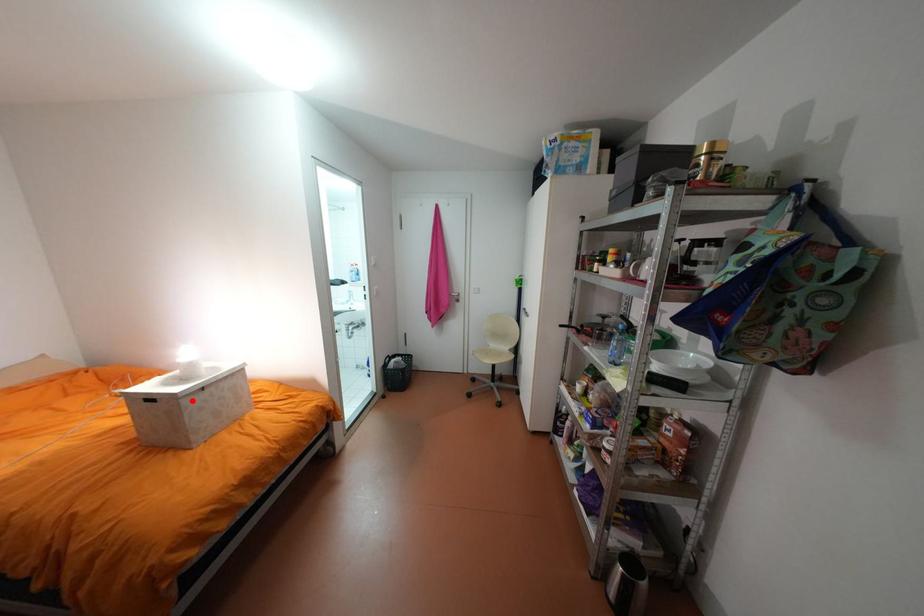
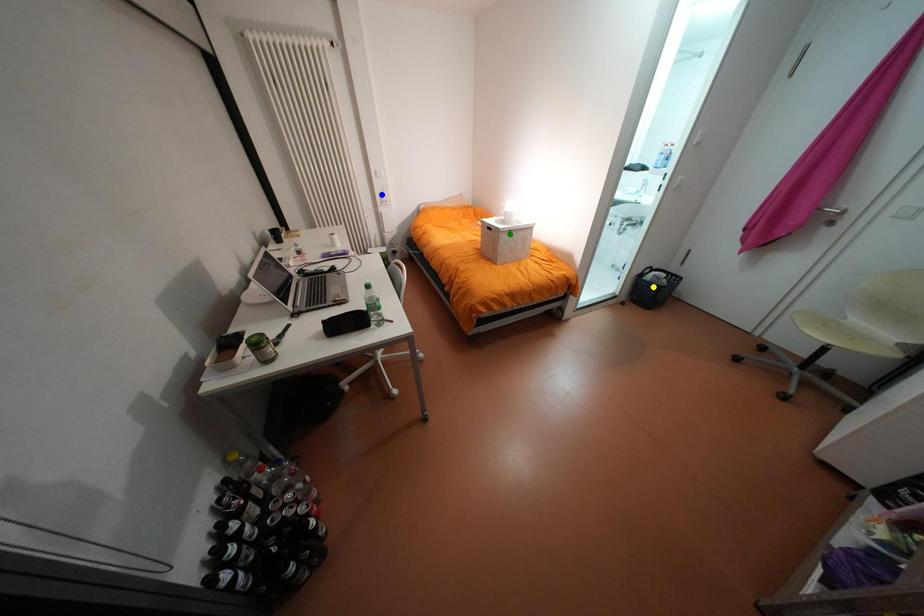
Question: I am providing you with two images of the same scene from different viewpoints. A red point is marked on the first image. You are given multiple points on the second image. Can you choose the point in image 2 that corresponds to the point in image 1?

Choices:
 (A) green point
 (B) blue point
 (C) yellow point

Answer: (A)